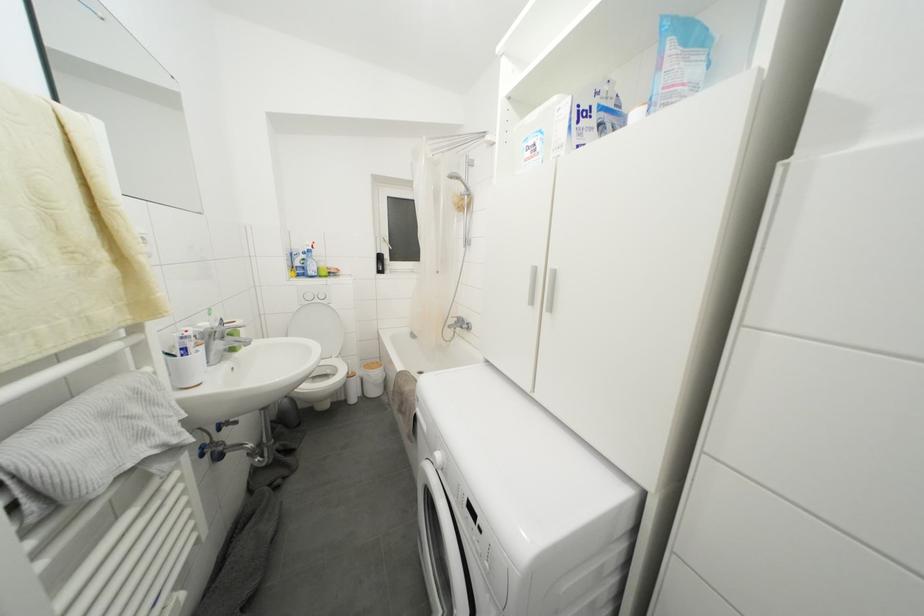
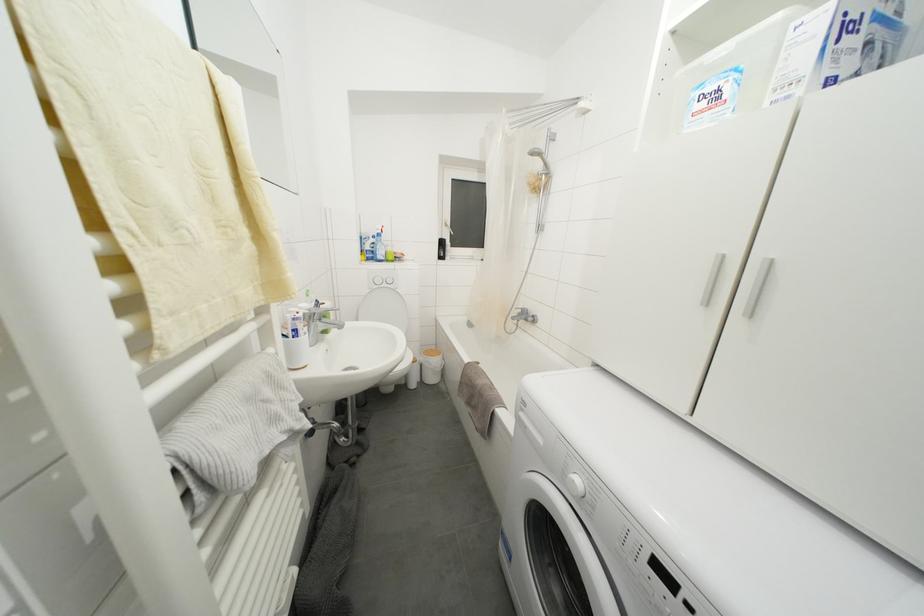
Question: The camera is either moving clockwise (left) or counter-clockwise (right) around the object. The first image is from the beginning of the video and the second image is from the end. Is the camera moving left or right when shooting the video?

Choices:
 (A) Left
 (B) Right

Answer: (B)